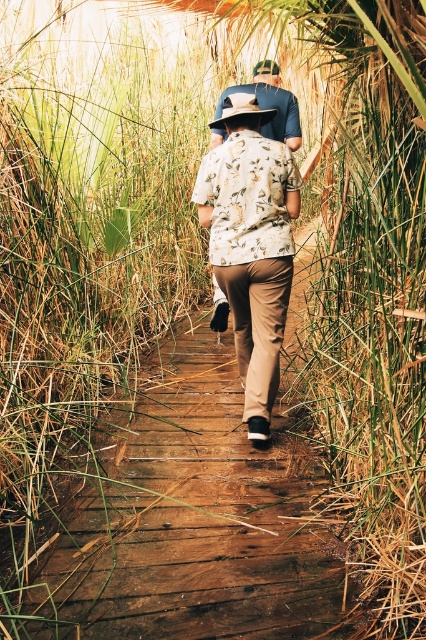
Based on the photo, can you confirm if white floral shirt at center is positioned to the left of matte blue shirt at center?

Yes, white floral shirt at center is to the left of matte blue shirt at center.

Does white floral shirt at center have a lesser height compared to matte blue shirt at center?

No, white floral shirt at center is not shorter than matte blue shirt at center.

Is point (267, 195) positioned behind point (293, 106)?

No.

The height and width of the screenshot is (640, 426). Find the location of `white floral shirt at center`. white floral shirt at center is located at coordinates (250, 244).